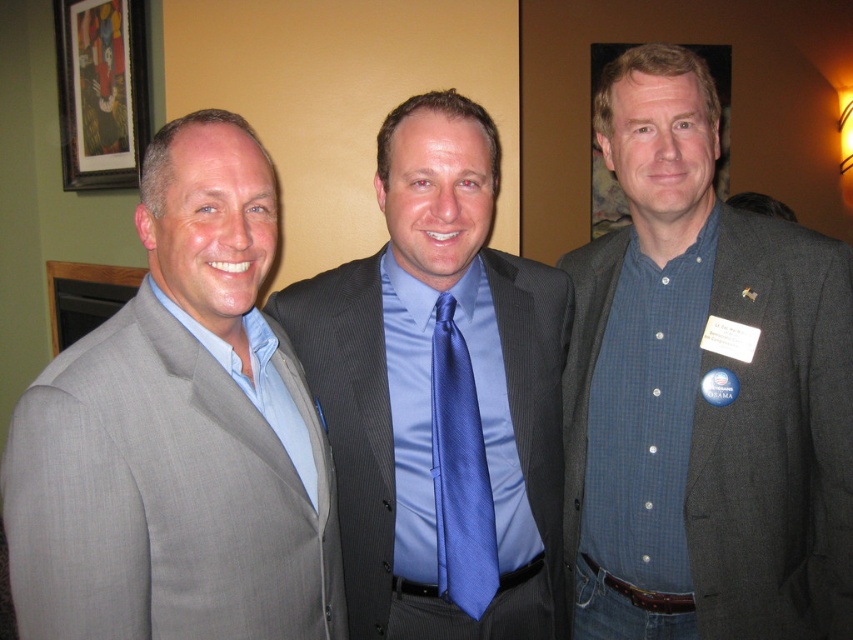
Who is higher up, gray suit at left or wooden framed artwork at upper left?

wooden framed artwork at upper left

Is gray suit at left closer to the viewer compared to wooden framed artwork at upper left?

Yes, it is.

Which is behind, point (253, 557) or point (90, 12)?

The point (90, 12) is more distant.

Identify the location of gray suit at left. The height and width of the screenshot is (640, 853). 178,433.

Is point (128, 323) in front of point (463, 180)?

That is True.

Does gray suit at left appear under blue satin tie at center?

Yes.

This screenshot has width=853, height=640. In order to click on gray suit at left in this screenshot , I will do `click(178, 433)`.

You are a GUI agent. You are given a task and a screenshot of the screen. Output one action in this format:
    pyautogui.click(x=<x>, y=<y>)
    Task: Click on the gray suit at left
    Image resolution: width=853 pixels, height=640 pixels.
    Given the screenshot: What is the action you would take?
    pyautogui.click(x=178, y=433)

Based on the photo, can you confirm if wooden framed artwork at upper left is positioned to the right of satin blue tie at center?

In fact, wooden framed artwork at upper left is to the left of satin blue tie at center.

Can you confirm if wooden framed artwork at upper left is positioned below satin blue tie at center?

No.

Which is behind, point (131, 131) or point (440, 451)?

Point (131, 131)

Locate an element on the screen. wooden framed artwork at upper left is located at coordinates (102, 92).